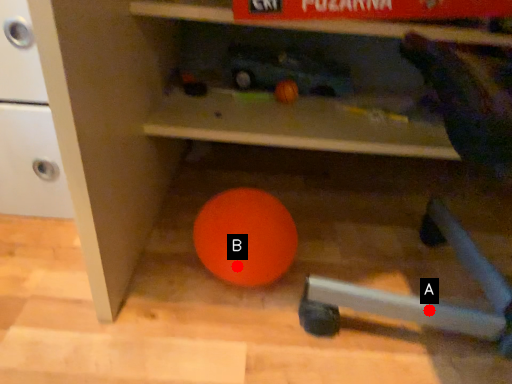
Question: Two points are circled on the image, labeled by A and B beside each circle. Which point is closer to the camera?

Choices:
 (A) A is closer
 (B) B is closer

Answer: (A)